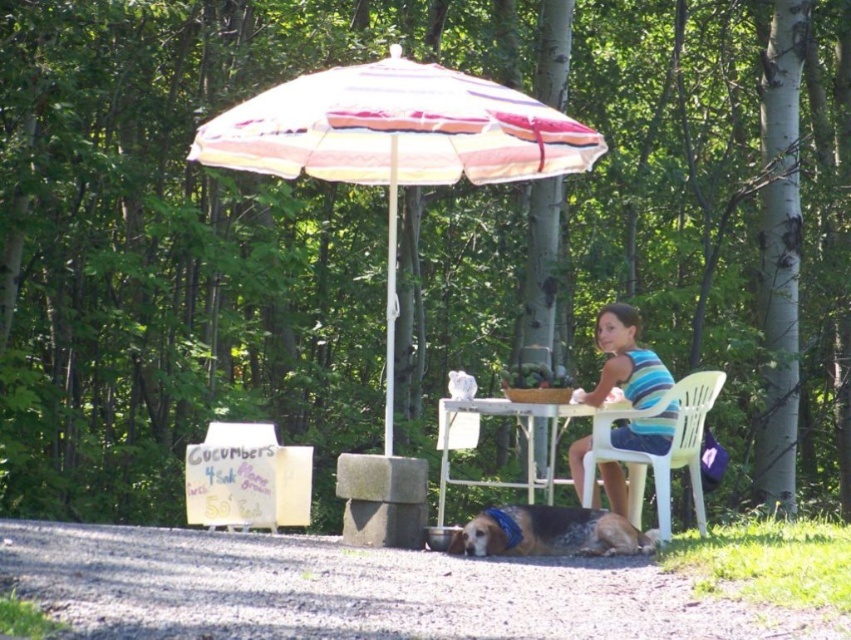
Which of these two, striped fabric shirt at center or white plastic table at center, stands shorter?

Standing shorter between the two is white plastic table at center.

Does striped fabric shirt at center come behind white plastic table at center?

No.

Between point (635, 433) and point (453, 410), which one is positioned behind?

Positioned behind is point (635, 433).

Locate an element on the screen. The height and width of the screenshot is (640, 851). striped fabric shirt at center is located at coordinates (626, 360).

Is striped fabric umbrella at center to the right of striped fabric shirt at center from the viewer's perspective?

No, striped fabric umbrella at center is not to the right of striped fabric shirt at center.

Between point (430, 76) and point (608, 342), which one is positioned in front?

Point (430, 76) is more forward.

Is point (323, 99) positioned before point (631, 378)?

Yes, it is in front of point (631, 378).

The height and width of the screenshot is (640, 851). What are the coordinates of `striped fabric umbrella at center` in the screenshot? It's located at (395, 141).

Can you confirm if white plastic chair at center is wider than brown speckled fur dog at lower center?

Incorrect, white plastic chair at center's width does not surpass brown speckled fur dog at lower center's.

Is white plastic chair at center above brown speckled fur dog at lower center?

Yes.

Describe the element at coordinates (657, 454) in the screenshot. I see `white plastic chair at center` at that location.

You are a GUI agent. You are given a task and a screenshot of the screen. Output one action in this format:
    pyautogui.click(x=<x>, y=<y>)
    Task: Click on the white plastic chair at center
    This screenshot has height=640, width=851.
    Given the screenshot: What is the action you would take?
    pyautogui.click(x=657, y=454)